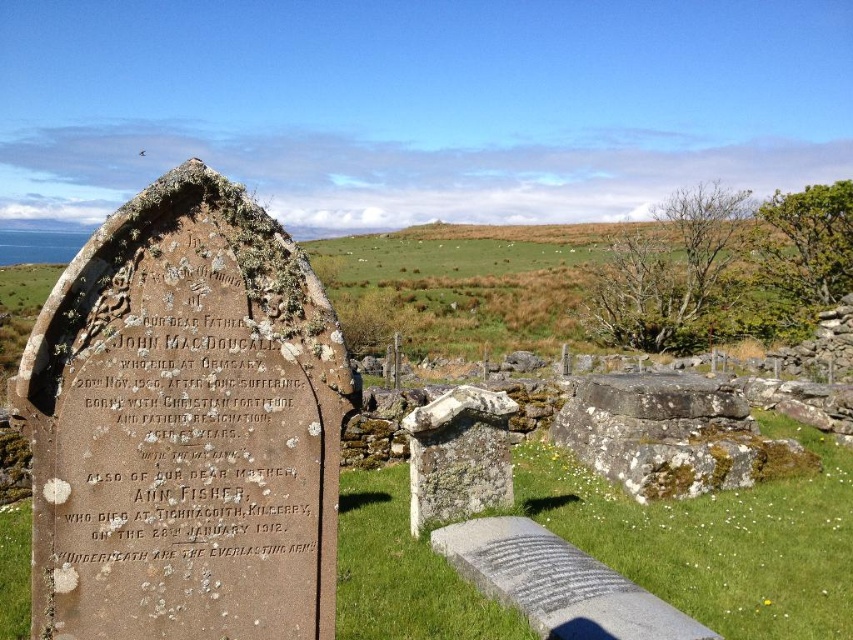
You are standing in a cemetery and see the rusty stone tombstone at left. If you want to touch it, how many steps do you need to take forward?

The rusty stone tombstone at left is 1.78 meters away from viewer. Assuming an average step is about 0.75 meters, you would need to take approximately 2 to 3 steps forward to reach it.

You are a groundskeeper in the cemetery. You need to place a new flowerpot between the rusty stone tombstone at left and the rough stone gravestone at center. Which tombstone should the flowerpot be closer to?

The rusty stone tombstone at left is positioned over rough stone gravestone at center, so the flowerpot should be placed closer to the rough stone gravestone at center to avoid blocking the tombstone above it.

You are standing in the cemetery looking at the rusty stone tombstone at left and the rough stone gravestone at center. Which tombstone is positioned more to the east side of the cemetery?

The rusty stone tombstone at left is positioned more to the east side of the cemetery because it is to the left of the rough stone gravestone at center, and in the scene, left typically corresponds to the east direction when facing the image.